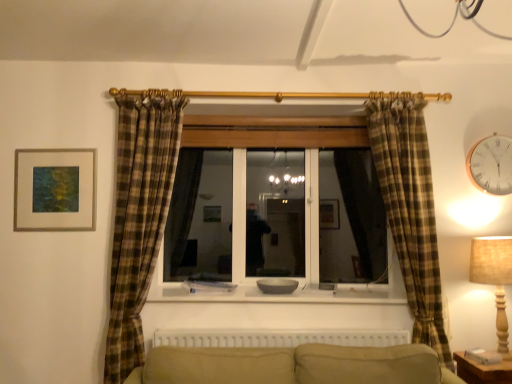
The image size is (512, 384). Find the location of `matte gold picture frame at upper left`. matte gold picture frame at upper left is located at coordinates (55, 189).

Image resolution: width=512 pixels, height=384 pixels. Describe the element at coordinates (55, 189) in the screenshot. I see `matte gold picture frame at upper left` at that location.

Where is `gold metallic clock at upper right`? Image resolution: width=512 pixels, height=384 pixels. gold metallic clock at upper right is located at coordinates pyautogui.click(x=490, y=164).

Where is `matte gold picture frame at upper left`? The image size is (512, 384). matte gold picture frame at upper left is located at coordinates (55, 189).

This screenshot has width=512, height=384. Identify the location of table lamp in front of the matte gold picture frame at upper left. [x=494, y=278].

Would you say matte gold picture frame at upper left is a long distance from beige fabric lampshade at right?

matte gold picture frame at upper left is positioned a significant distance from beige fabric lampshade at right.

Is matte gold picture frame at upper left facing towards beige fabric lampshade at right?

No, matte gold picture frame at upper left is not facing towards beige fabric lampshade at right.

Consider the image. Who is bigger, matte gold picture frame at upper left or beige fabric lampshade at right?

beige fabric lampshade at right.

Considering the relative sizes of smooth white window sill at center and gold metallic clock at upper right in the image provided, is smooth white window sill at center bigger than gold metallic clock at upper right?

Indeed, smooth white window sill at center has a larger size compared to gold metallic clock at upper right.

From a real-world perspective, is smooth white window sill at center over gold metallic clock at upper right?

No, from a real-world perspective, smooth white window sill at center is not on top of gold metallic clock at upper right.

Which is more to the left, smooth white window sill at center or gold metallic clock at upper right?

smooth white window sill at center.

In the scene shown: Which is more distant, (x=303, y=290) or (x=490, y=174)?

The point (x=303, y=290) is farther from the camera.

Is gold metallic clock at upper right bigger or smaller than beige fabric lampshade at right?

gold metallic clock at upper right is smaller than beige fabric lampshade at right.

Which of these two, gold metallic clock at upper right or beige fabric lampshade at right, stands taller?

Standing taller between the two is beige fabric lampshade at right.

Does point (490, 166) come farther from viewer compared to point (475, 251)?

That is True.

Is gold metallic clock at upper right surrounding beige fabric lampshade at right?

No, beige fabric lampshade at right is not a part of gold metallic clock at upper right.

In terms of height, does gold metallic clock at upper right look taller or shorter compared to smooth white window sill at center?

gold metallic clock at upper right is taller than smooth white window sill at center.

Which object is wider, gold metallic clock at upper right or smooth white window sill at center?

With larger width is smooth white window sill at center.

Is gold metallic clock at upper right turned away from smooth white window sill at center?

That's not correct — gold metallic clock at upper right is not looking away from smooth white window sill at center.

Is gold metallic clock at upper right touching smooth white window sill at center?

gold metallic clock at upper right is not next to smooth white window sill at center, and they're not touching.

Is beige fabric lampshade at right facing away from white plastic radiator at lower center?

No, beige fabric lampshade at right is not facing away from white plastic radiator at lower center.

From the image's perspective, which one is positioned lower, beige fabric lampshade at right or white plastic radiator at lower center?

white plastic radiator at lower center, from the image's perspective.

Choose the correct answer: Is beige fabric lampshade at right inside white plastic radiator at lower center or outside it?

The correct answer is: outside.

Which of these two, beige fabric lampshade at right or white plastic radiator at lower center, is wider?

beige fabric lampshade at right is wider.

Considering the sizes of smooth white window sill at center and matte gold picture frame at upper left in the image, is smooth white window sill at center taller or shorter than matte gold picture frame at upper left?

Considering their sizes, smooth white window sill at center has less height than matte gold picture frame at upper left.

Is smooth white window sill at center further to the viewer compared to matte gold picture frame at upper left?

That is False.

Between smooth white window sill at center and matte gold picture frame at upper left, which one has larger width?

smooth white window sill at center.

Is point (316, 292) positioned before point (36, 173)?

No, it is behind (36, 173).

Can you tell me how much beige fabric lampshade at right and smooth white window sill at center differ in facing direction?

There is a 1.6-degree angle between the facing directions of beige fabric lampshade at right and smooth white window sill at center.

Does beige fabric lampshade at right appear on the left side of smooth white window sill at center?

No, beige fabric lampshade at right is not to the left of smooth white window sill at center.

Is beige fabric lampshade at right smaller than smooth white window sill at center?

No, beige fabric lampshade at right is not smaller than smooth white window sill at center.

The height and width of the screenshot is (384, 512). I want to click on table lamp on the right of matte gold picture frame at upper left, so click(494, 278).

Image resolution: width=512 pixels, height=384 pixels. Find the location of `window sill that appears in front of the gold metallic clock at upper right`. window sill that appears in front of the gold metallic clock at upper right is located at coordinates (279, 294).

Estimate the real-world distances between objects in this image. Which object is further from white plastic radiator at lower center, matte gold picture frame at upper left or smooth white window sill at center?

Among the two, matte gold picture frame at upper left is located further to white plastic radiator at lower center.

Looking at the image, which one is located closer to smooth white window sill at center, gold metallic clock at upper right or matte gold picture frame at upper left?

matte gold picture frame at upper left lies closer to smooth white window sill at center than the other object.

Looking at the image, which one is located closer to beige fabric lampshade at right, gold metallic clock at upper right or smooth white window sill at center?

Based on the image, gold metallic clock at upper right appears to be nearer to beige fabric lampshade at right.

From the image, which object appears to be farther from beige fabric lampshade at right, smooth white window sill at center or white plastic radiator at lower center?

white plastic radiator at lower center lies further to beige fabric lampshade at right than the other object.

When comparing their distances from smooth white window sill at center, does beige fabric lampshade at right or matte gold picture frame at upper left seem closer?

beige fabric lampshade at right is closer to smooth white window sill at center.

Estimate the real-world distances between objects in this image. Which object is closer to matte gold picture frame at upper left, smooth white window sill at center or white plastic radiator at lower center?

smooth white window sill at center is closer to matte gold picture frame at upper left.

Which object lies nearer to the anchor point smooth white window sill at center, beige fabric lampshade at right or white plastic radiator at lower center?

Based on the image, white plastic radiator at lower center appears to be nearer to smooth white window sill at center.

Estimate the real-world distances between objects in this image. Which object is closer to beige fabric lampshade at right, smooth white window sill at center or gold metallic clock at upper right?

Among the two, gold metallic clock at upper right is located nearer to beige fabric lampshade at right.

At what (x,y) coordinates should I click in order to perform the action: click on radiator between matte gold picture frame at upper left and beige fabric lampshade at right. Please return your answer as a coordinate pair (x, y). This screenshot has height=384, width=512. Looking at the image, I should click on (277, 337).

This screenshot has width=512, height=384. What are the coordinates of `table lamp between white plastic radiator at lower center and gold metallic clock at upper right` in the screenshot? It's located at (494, 278).

Locate an element on the screen. radiator situated between smooth white window sill at center and beige fabric lampshade at right from left to right is located at coordinates (277, 337).

At what (x,y) coordinates should I click in order to perform the action: click on window sill situated between matte gold picture frame at upper left and beige fabric lampshade at right from left to right. Please return your answer as a coordinate pair (x, y). The width and height of the screenshot is (512, 384). Looking at the image, I should click on (279, 294).